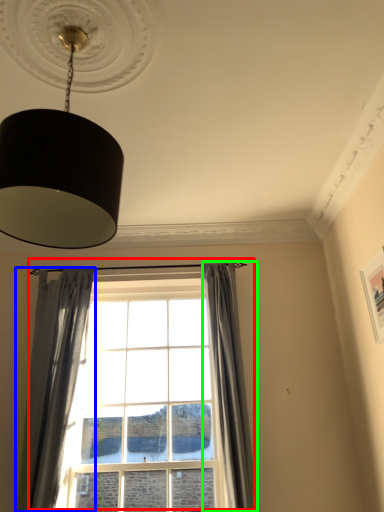
Question: Based on their relative distances, which object is nearer to window (highlighted by a red box)? Choose from curtain (highlighted by a blue box) and curtain (highlighted by a green box).

Choices:
 (A) curtain
 (B) curtain

Answer: (B)